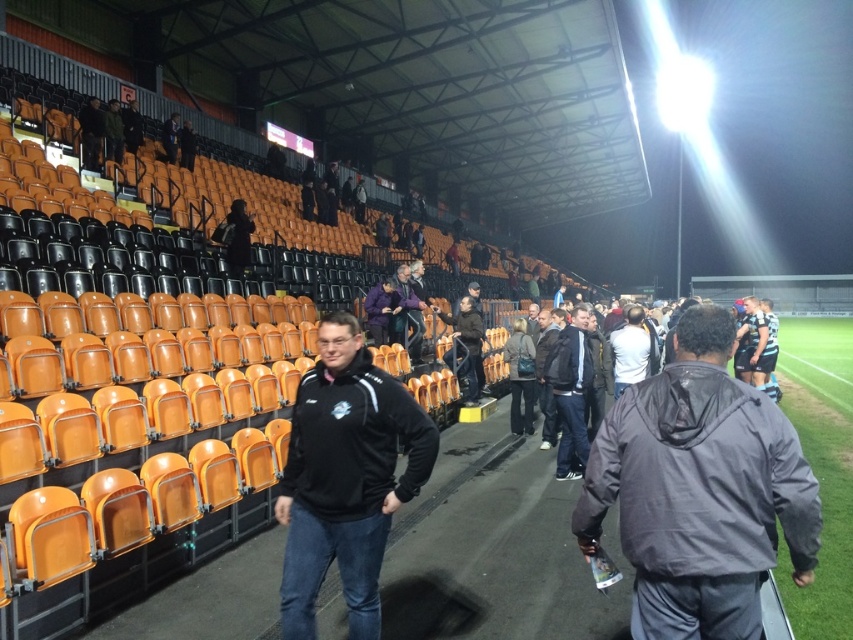
You are a photographer trying to capture both the dark brown leather jacket at center and the purple softshell jacket at upper center in a single photo. However, you can only focus on one of them clearly. Which jacket should you choose to ensure the other remains in the background?

You should focus on the dark brown leather jacket at center because the purple softshell jacket at upper center is behind it, so keeping the dark brown leather jacket in focus will naturally place the purple jacket in the background.

In the scene shown: You are standing in the stadium and see the gray matte jacket at center. If you want to reach it in 2 seconds, what is the minimum speed you need to move at?

The gray matte jacket at center is 6.70 feet away from viewer. To cover 6.70 feet in 2 seconds, the minimum speed required is 3.35 feet per second.